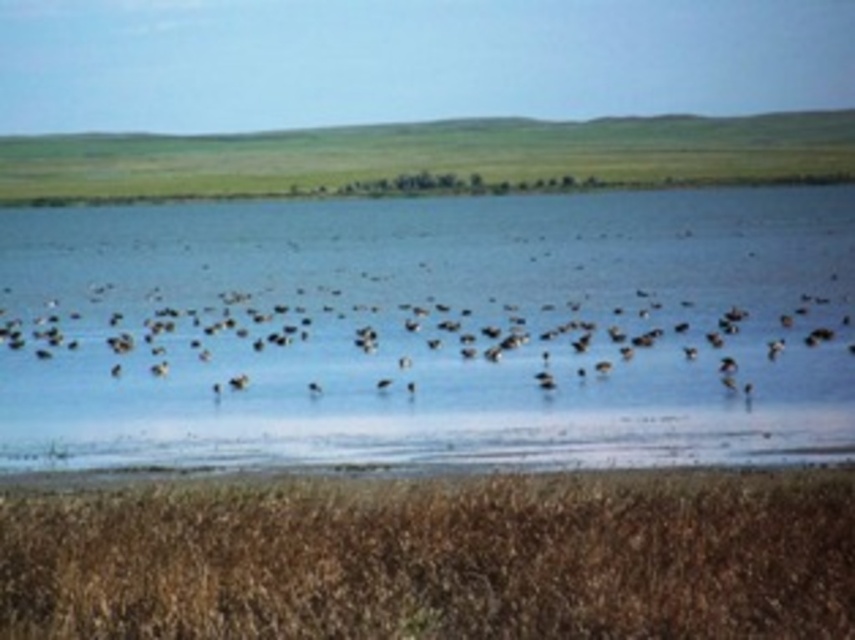
Question: Which point is farther to the camera?

Choices:
 (A) (93, 636)
 (B) (600, 288)

Answer: (B)

Question: Estimate the real-world distances between objects in this image. Which object is farther from the clear blue water at center?

Choices:
 (A) brown matte birds at center
 (B) brown grass at lower center

Answer: (B)

Question: Which point is closer to the camera?

Choices:
 (A) (597, 307)
 (B) (74, 632)

Answer: (B)

Question: Can you confirm if clear blue water at center is positioned below brown matte birds at center?

Choices:
 (A) yes
 (B) no

Answer: (B)

Question: Is brown grass at lower center below brown matte birds at center?

Choices:
 (A) yes
 (B) no

Answer: (A)

Question: Does clear blue water at center appear on the left side of brown grass at lower center?

Choices:
 (A) yes
 (B) no

Answer: (A)